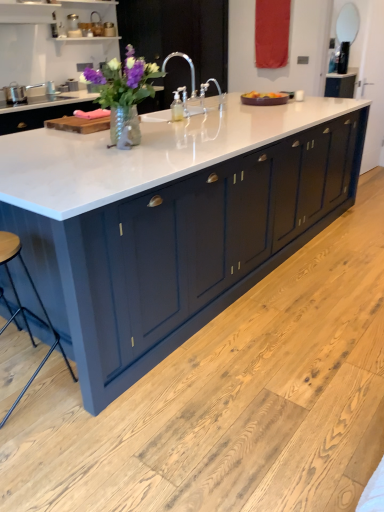
Question: From the image's perspective, is matte silver mirror at upper right below white marble countertop at center?

Choices:
 (A) no
 (B) yes

Answer: (A)

Question: Considering the relative sizes of matte silver mirror at upper right and white marble countertop at center in the image provided, is matte silver mirror at upper right smaller than white marble countertop at center?

Choices:
 (A) yes
 (B) no

Answer: (A)

Question: Is matte silver mirror at upper right outside white marble countertop at center?

Choices:
 (A) no
 (B) yes

Answer: (B)

Question: Does matte silver mirror at upper right come behind white marble countertop at center?

Choices:
 (A) yes
 (B) no

Answer: (A)

Question: Is matte silver mirror at upper right facing towards white marble countertop at center?

Choices:
 (A) no
 (B) yes

Answer: (B)

Question: Are matte silver mirror at upper right and white marble countertop at center beside each other?

Choices:
 (A) yes
 (B) no

Answer: (B)

Question: From a real-world perspective, is wooden seat at lower left under matte glass vase at center?

Choices:
 (A) yes
 (B) no

Answer: (A)

Question: Is wooden seat at lower left with matte glass vase at center?

Choices:
 (A) yes
 (B) no

Answer: (B)

Question: Considering the relative positions of wooden seat at lower left and matte glass vase at center in the image provided, is wooden seat at lower left in front of matte glass vase at center?

Choices:
 (A) no
 (B) yes

Answer: (B)

Question: Can we say wooden seat at lower left lies outside matte glass vase at center?

Choices:
 (A) yes
 (B) no

Answer: (A)

Question: Is wooden seat at lower left far away from matte glass vase at center?

Choices:
 (A) no
 (B) yes

Answer: (B)

Question: Is wooden seat at lower left looking in the opposite direction of matte glass vase at center?

Choices:
 (A) no
 (B) yes

Answer: (A)

Question: Is white marble countertop at center located outside matte glass vase at center?

Choices:
 (A) yes
 (B) no

Answer: (A)